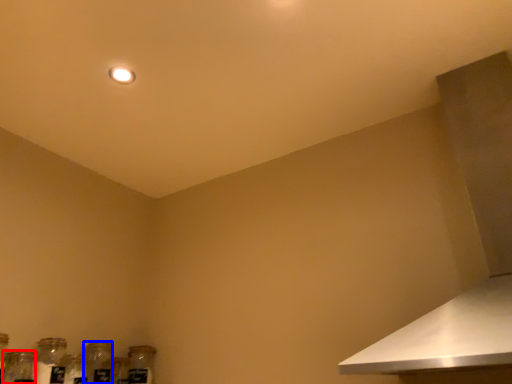
Question: Which object is closer to the camera taking this photo, glass jar (highlighted by a red box) or bottle (highlighted by a blue box)?

Choices:
 (A) glass jar
 (B) bottle

Answer: (A)